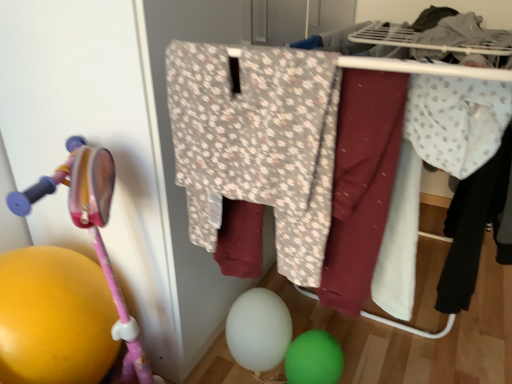
Question: In which direction should I rotate to look at white matte balloon at lower center, the 1th balloon from the left?

Choices:
 (A) right
 (B) left

Answer: (A)

Question: Can you confirm if pink plastic baby carriage at left is thinner than green rubber balloon at lower center, arranged as the first balloon when viewed from the right?

Choices:
 (A) no
 (B) yes

Answer: (A)

Question: Considering the relative sizes of pink plastic baby carriage at left and green rubber balloon at lower center, arranged as the first balloon when viewed from the right, in the image provided, is pink plastic baby carriage at left bigger than green rubber balloon at lower center, arranged as the first balloon when viewed from the right,?

Choices:
 (A) yes
 (B) no

Answer: (A)

Question: Does pink plastic baby carriage at left have a lesser height compared to green rubber balloon at lower center, arranged as the first balloon when viewed from the right?

Choices:
 (A) yes
 (B) no

Answer: (B)

Question: From a real-world perspective, is pink plastic baby carriage at left located beneath green rubber balloon at lower center, arranged as the first balloon when viewed from the right?

Choices:
 (A) no
 (B) yes

Answer: (A)

Question: Does pink plastic baby carriage at left have a greater width compared to green rubber balloon at lower center, which ranks as the second balloon in left-to-right order?

Choices:
 (A) yes
 (B) no

Answer: (A)

Question: From a real-world perspective, is pink plastic baby carriage at left physically above green rubber balloon at lower center, arranged as the first balloon when viewed from the right?

Choices:
 (A) yes
 (B) no

Answer: (A)

Question: Is green rubber balloon at lower center, which ranks as the second balloon in left-to-right order, located within light blue dotted fabric at right, which is the first clothing from right to left?

Choices:
 (A) yes
 (B) no

Answer: (B)

Question: From the image's perspective, is light blue dotted fabric at right, which is counted as the first clothing, starting from the back, below green rubber balloon at lower center, arranged as the first balloon when viewed from the right?

Choices:
 (A) no
 (B) yes

Answer: (A)

Question: From a real-world perspective, is light blue dotted fabric at right, which is counted as the first clothing, starting from the back, beneath green rubber balloon at lower center, arranged as the first balloon when viewed from the right?

Choices:
 (A) yes
 (B) no

Answer: (B)

Question: Is light blue dotted fabric at right, the 3th clothing positioned from the left, oriented away from green rubber balloon at lower center, arranged as the first balloon when viewed from the right?

Choices:
 (A) yes
 (B) no

Answer: (B)

Question: Considering the relative sizes of light blue dotted fabric at right, which is counted as the first clothing, starting from the back, and green rubber balloon at lower center, which ranks as the second balloon in left-to-right order, in the image provided, is light blue dotted fabric at right, which is counted as the first clothing, starting from the back, smaller than green rubber balloon at lower center, which ranks as the second balloon in left-to-right order,?

Choices:
 (A) yes
 (B) no

Answer: (B)

Question: From a real-world perspective, is light blue dotted fabric at right, which is the first clothing from right to left, over green rubber balloon at lower center, arranged as the first balloon when viewed from the right?

Choices:
 (A) no
 (B) yes

Answer: (B)

Question: Considering the relative sizes of green rubber balloon at lower center, arranged as the first balloon when viewed from the right, and floral fabric pants at center in the image provided, is green rubber balloon at lower center, arranged as the first balloon when viewed from the right, thinner than floral fabric pants at center?

Choices:
 (A) no
 (B) yes

Answer: (B)